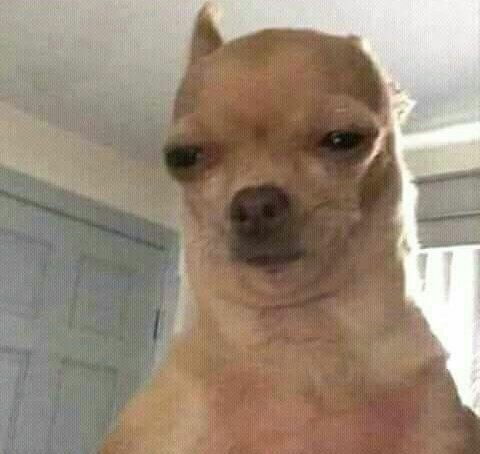
This screenshot has height=454, width=480. Find the location of `gap between top of door and door frame`. gap between top of door and door frame is located at coordinates (72, 217).